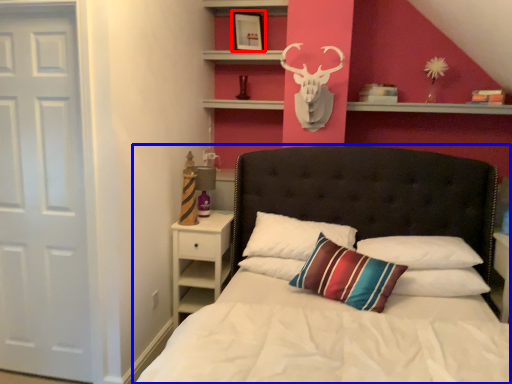
Question: Which point is closer to the camera, picture frame (highlighted by a red box) or bed (highlighted by a blue box)?

Choices:
 (A) picture frame
 (B) bed

Answer: (B)